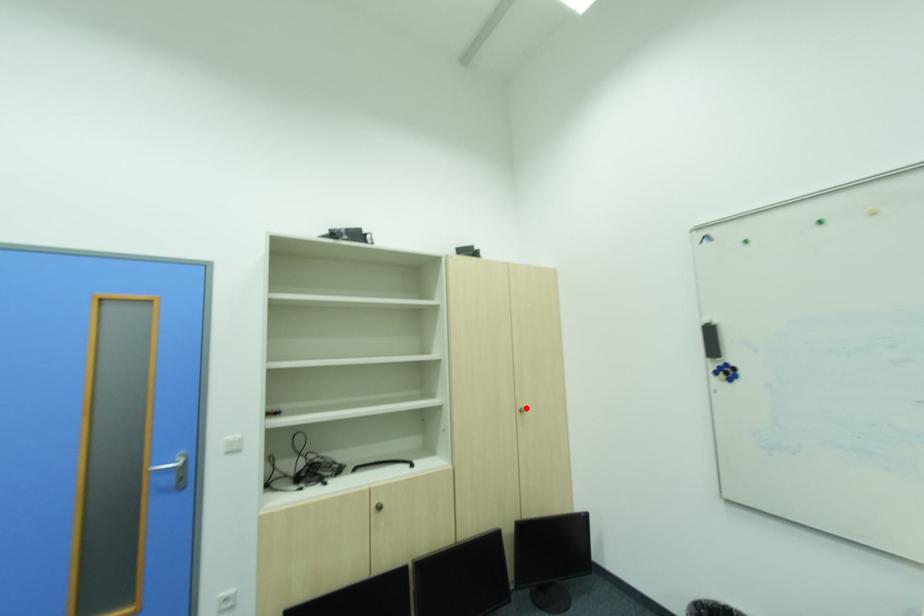
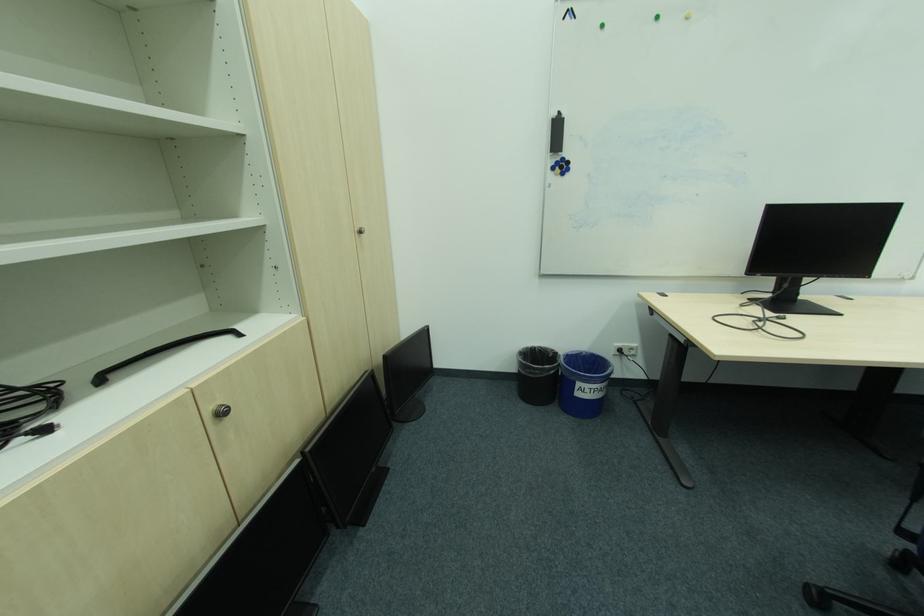
In the second image, find the point that corresponds to the highlighted location in the first image.

(363, 229)